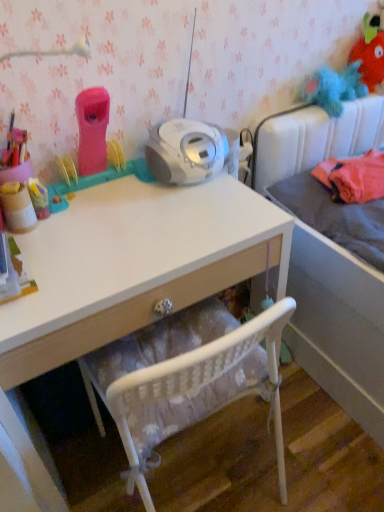
The width and height of the screenshot is (384, 512). What are the coordinates of `vacant area that lies to the right of matte brown jar at left, which is counted as the third toy, starting from the right` in the screenshot? It's located at (94, 223).